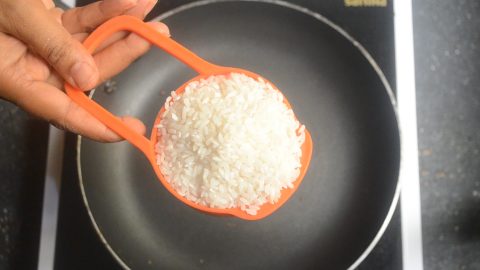
Locate an element on the screen. The height and width of the screenshot is (270, 480). orange cup handle is located at coordinates (99, 34).